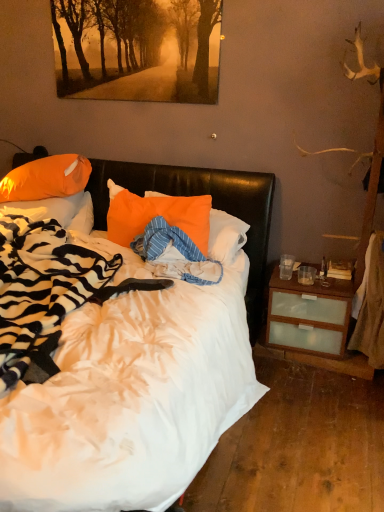
This screenshot has width=384, height=512. What do you see at coordinates (58, 211) in the screenshot?
I see `orange fabric pillow at left, positioned as the third pillow in right-to-left order` at bounding box center [58, 211].

Locate an element on the screen. Image resolution: width=384 pixels, height=512 pixels. white soft bed at center is located at coordinates (143, 368).

Identify the location of orange fabric pillow at left, positioned as the third pillow in right-to-left order. This screenshot has width=384, height=512. (58, 211).

Does white soft bed at center have a larger size compared to golden textured pathway at upper center?

Yes, white soft bed at center is bigger than golden textured pathway at upper center.

Is point (95, 495) less distant than point (106, 30)?

Yes.

Is white soft bed at center aimed at golden textured pathway at upper center?

Result: No.

Is white soft bed at center taller than golden textured pathway at upper center?

Correct, white soft bed at center is much taller as golden textured pathway at upper center.

From the picture: Does golden textured pathway at upper center turn towards orange fabric pillow at center, the first pillow when ordered from right to left?

No, golden textured pathway at upper center is not turned towards orange fabric pillow at center, the first pillow when ordered from right to left.

Relative to orange fabric pillow at center, the first pillow when ordered from right to left, is golden textured pathway at upper center in front or behind?

Visually, golden textured pathway at upper center is located behind orange fabric pillow at center, the first pillow when ordered from right to left.

Is point (38, 203) closer to camera compared to point (169, 197)?

No, it is behind (169, 197).

From the image's perspective, is orange fabric pillow at left, positioned as the third pillow in right-to-left order, above or below orange fabric pillow at center, the 3th pillow viewed from the left?

Clearly, from the image's perspective, orange fabric pillow at left, positioned as the third pillow in right-to-left order, is above orange fabric pillow at center, the 3th pillow viewed from the left.

Between orange fabric pillow at left, positioned as the third pillow in right-to-left order, and orange fabric pillow at center, the 3th pillow viewed from the left, which one has more height?

orange fabric pillow at center, the 3th pillow viewed from the left, is taller.

Choose the correct answer: Is orange fabric pillow at left, which is the 1th pillow from left to right, inside orange fabric pillow at center, the first pillow when ordered from right to left, or outside it?

orange fabric pillow at left, which is the 1th pillow from left to right, lies outside orange fabric pillow at center, the first pillow when ordered from right to left.

From a real-world perspective, does orange glossy pillow at upper left, which is the second pillow in left-to-right order, stand above white soft bed at center?

Yes, from a real-world perspective, orange glossy pillow at upper left, which is the second pillow in left-to-right order, is on top of white soft bed at center.

Considering the sizes of objects orange glossy pillow at upper left, acting as the 2th pillow starting from the right, and white soft bed at center in the image provided, who is smaller, orange glossy pillow at upper left, acting as the 2th pillow starting from the right, or white soft bed at center?

orange glossy pillow at upper left, acting as the 2th pillow starting from the right.

Relative to white soft bed at center, is orange glossy pillow at upper left, acting as the 2th pillow starting from the right, in front or behind?

In the image, orange glossy pillow at upper left, acting as the 2th pillow starting from the right, appears behind white soft bed at center.

Which is behind, point (62, 90) or point (26, 191)?

The point (62, 90) is farther from the camera.

Is golden textured pathway at upper center taller or shorter than orange glossy pillow at upper left, acting as the 2th pillow starting from the right?

In the image, golden textured pathway at upper center appears to be taller than orange glossy pillow at upper left, acting as the 2th pillow starting from the right.

Would you say golden textured pathway at upper center contains orange glossy pillow at upper left, which is the second pillow in left-to-right order?

No, orange glossy pillow at upper left, which is the second pillow in left-to-right order, is located outside of golden textured pathway at upper center.

Measure the distance between golden textured pathway at upper center and orange glossy pillow at upper left, acting as the 2th pillow starting from the right.

They are 30.90 inches apart.

Is point (237, 333) closer to camera compared to point (46, 163)?

Yes, it is.

Is orange glossy pillow at upper left, which is the second pillow in left-to-right order, completely or partially inside white soft bed at center?

Yes, orange glossy pillow at upper left, which is the second pillow in left-to-right order, is a part of white soft bed at center.

Measure the distance from white soft bed at center to orange glossy pillow at upper left, which is the second pillow in left-to-right order.

The distance of white soft bed at center from orange glossy pillow at upper left, which is the second pillow in left-to-right order, is 1.15 meters.

In the scene shown: Does white soft bed at center have a lesser width compared to orange glossy pillow at upper left, which is the second pillow in left-to-right order?

No.

Based on the photo, from a real-world perspective, is orange fabric pillow at center, the 3th pillow viewed from the left, physically located above or below white soft bed at center?

orange fabric pillow at center, the 3th pillow viewed from the left, is above white soft bed at center.

In the scene shown: Which object is thinner, orange fabric pillow at center, the 3th pillow viewed from the left, or white soft bed at center?

Thinner between the two is orange fabric pillow at center, the 3th pillow viewed from the left.

Which object is closer to the camera taking this photo, orange fabric pillow at center, the first pillow when ordered from right to left, or white soft bed at center?

white soft bed at center is in front.

Find the location of a particular element. The image size is (384, 512). bed in front of the orange fabric pillow at center, the first pillow when ordered from right to left is located at coordinates (143, 368).

At what (x,y) coordinates should I click in order to perform the action: click on bed on the left of golden textured pathway at upper center. Please return your answer as a coordinate pair (x, y). The width and height of the screenshot is (384, 512). Looking at the image, I should click on (143, 368).

You are a GUI agent. You are given a task and a screenshot of the screen. Output one action in this format:
    pyautogui.click(x=<x>, y=<y>)
    Task: Click on the tree behind the orange fabric pillow at center, the first pillow when ordered from right to left
    This screenshot has height=512, width=384.
    Given the screenshot: What is the action you would take?
    pyautogui.click(x=137, y=49)

Considering their positions, is orange glossy pillow at upper left, which is the second pillow in left-to-right order, positioned closer to orange fabric pillow at center, the first pillow when ordered from right to left, than golden textured pathway at upper center?

The object closer to orange fabric pillow at center, the first pillow when ordered from right to left, is orange glossy pillow at upper left, which is the second pillow in left-to-right order.

When comparing their distances from golden textured pathway at upper center, does orange fabric pillow at center, the 3th pillow viewed from the left, or white soft bed at center seem closer?

orange fabric pillow at center, the 3th pillow viewed from the left, is closer to golden textured pathway at upper center.

Which object lies further to the anchor point white soft bed at center, orange glossy pillow at upper left, acting as the 2th pillow starting from the right, or orange fabric pillow at center, the first pillow when ordered from right to left?

Based on the image, orange glossy pillow at upper left, acting as the 2th pillow starting from the right, appears to be further to white soft bed at center.

From the image, which object appears to be farther from orange fabric pillow at left, which is the 1th pillow from left to right, orange glossy pillow at upper left, which is the second pillow in left-to-right order, or white soft bed at center?

white soft bed at center is positioned further to the anchor orange fabric pillow at left, which is the 1th pillow from left to right.

In the scene shown: Estimate the real-world distances between objects in this image. Which object is further from white soft bed at center, orange fabric pillow at left, positioned as the third pillow in right-to-left order, or orange glossy pillow at upper left, acting as the 2th pillow starting from the right?

orange glossy pillow at upper left, acting as the 2th pillow starting from the right.

Looking at the image, which one is located closer to orange fabric pillow at left, positioned as the third pillow in right-to-left order, orange fabric pillow at center, the first pillow when ordered from right to left, or white soft bed at center?

Based on the image, orange fabric pillow at center, the first pillow when ordered from right to left, appears to be nearer to orange fabric pillow at left, positioned as the third pillow in right-to-left order.

Considering their positions, is orange glossy pillow at upper left, acting as the 2th pillow starting from the right, positioned further to orange fabric pillow at center, the first pillow when ordered from right to left, than white soft bed at center?

Among the two, orange glossy pillow at upper left, acting as the 2th pillow starting from the right, is located further to orange fabric pillow at center, the first pillow when ordered from right to left.

Which object lies nearer to the anchor point white soft bed at center, golden textured pathway at upper center or orange fabric pillow at left, positioned as the third pillow in right-to-left order?

The object closer to white soft bed at center is orange fabric pillow at left, positioned as the third pillow in right-to-left order.

The image size is (384, 512). Identify the location of pillow positioned between white soft bed at center and golden textured pathway at upper center from near to far. (156, 215).

Find the location of a particular element. tree between white soft bed at center and orange glossy pillow at upper left, acting as the 2th pillow starting from the right, from front to back is located at coordinates (137, 49).

Where is `pillow between golden textured pathway at upper center and orange fabric pillow at left, positioned as the third pillow in right-to-left order, from top to bottom`? The width and height of the screenshot is (384, 512). pillow between golden textured pathway at upper center and orange fabric pillow at left, positioned as the third pillow in right-to-left order, from top to bottom is located at coordinates (46, 178).

At what (x,y) coordinates should I click in order to perform the action: click on pillow between orange fabric pillow at left, positioned as the third pillow in right-to-left order, and orange fabric pillow at center, the first pillow when ordered from right to left. Please return your answer as a coordinate pair (x, y). Looking at the image, I should click on (46, 178).